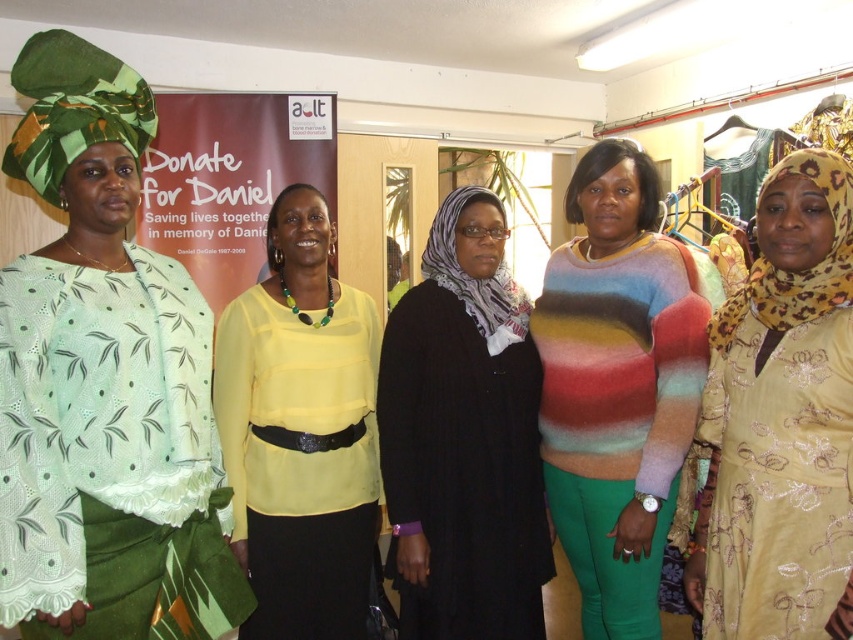
Question: Is matte green fabric at left thinner than gold embroidered dress at right?

Choices:
 (A) no
 (B) yes

Answer: (A)

Question: Which of the following is the closest to the observer?

Choices:
 (A) click(727, 392)
 (B) click(193, 461)

Answer: (B)

Question: Can you confirm if gold embroidered dress at right is positioned to the right of yellow satin blouse at center?

Choices:
 (A) no
 (B) yes

Answer: (B)

Question: Which is farther from the black ribbed sweater at center?

Choices:
 (A) multicolored fuzzy sweater at center
 (B) yellow satin blouse at center
 (C) matte green fabric at left

Answer: (C)

Question: Considering the relative positions of gold embroidered dress at right and multicolored fuzzy sweater at center in the image provided, where is gold embroidered dress at right located with respect to multicolored fuzzy sweater at center?

Choices:
 (A) right
 (B) left

Answer: (A)

Question: Which of the following is the farthest from the observer?

Choices:
 (A) matte green fabric at left
 (B) yellow satin blouse at center

Answer: (B)